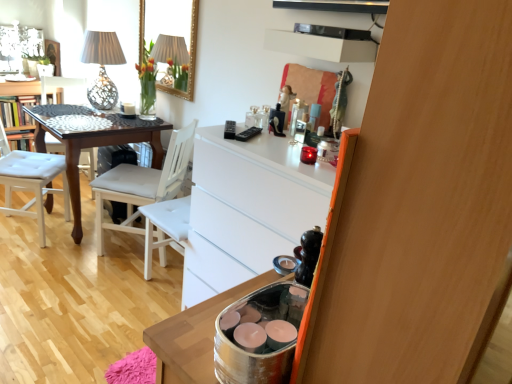
Question: Is white glossy vanity at upper left at the left side of matte white lampshade at upper left?

Choices:
 (A) no
 (B) yes

Answer: (B)

Question: Can you confirm if white glossy vanity at upper left is thinner than matte white lampshade at upper left?

Choices:
 (A) no
 (B) yes

Answer: (A)

Question: Is white glossy vanity at upper left far from matte white lampshade at upper left?

Choices:
 (A) no
 (B) yes

Answer: (A)

Question: Is white glossy vanity at upper left facing towards matte white lampshade at upper left?

Choices:
 (A) no
 (B) yes

Answer: (B)

Question: Is white glossy vanity at upper left wider than matte white lampshade at upper left?

Choices:
 (A) no
 (B) yes

Answer: (B)

Question: Considering the positions of white fabric chair at center, which ranks as the first chair in right-to-left order, and white glossy vanity at upper left in the image, is white fabric chair at center, which ranks as the first chair in right-to-left order, taller or shorter than white glossy vanity at upper left?

Choices:
 (A) tall
 (B) short

Answer: (A)

Question: From the image's perspective, relative to white glossy vanity at upper left, is white fabric chair at center, which ranks as the first chair in right-to-left order, above or below?

Choices:
 (A) above
 (B) below

Answer: (B)

Question: Is white fabric chair at center, which ranks as the first chair in right-to-left order, spatially inside white glossy vanity at upper left, or outside of it?

Choices:
 (A) outside
 (B) inside

Answer: (A)

Question: Relative to white glossy vanity at upper left, is white fabric chair at center, which appears as the third chair when viewed from the left, in front or behind?

Choices:
 (A) front
 (B) behind

Answer: (A)

Question: Based on their sizes in the image, would you say matte white lampshade at upper left is bigger or smaller than dark wood table at left?

Choices:
 (A) small
 (B) big

Answer: (A)

Question: From a real-world perspective, is matte white lampshade at upper left positioned above or below dark wood table at left?

Choices:
 (A) below
 (B) above

Answer: (B)

Question: From the image's perspective, is matte white lampshade at upper left positioned above or below dark wood table at left?

Choices:
 (A) above
 (B) below

Answer: (A)

Question: Is matte white lampshade at upper left taller or shorter than dark wood table at left?

Choices:
 (A) tall
 (B) short

Answer: (B)

Question: From a real-world perspective, is wooden dresser at right positioned above or below matte white lampshade at upper left?

Choices:
 (A) below
 (B) above

Answer: (B)

Question: Is point (509, 147) closer or farther from the camera than point (101, 69)?

Choices:
 (A) closer
 (B) farther

Answer: (A)